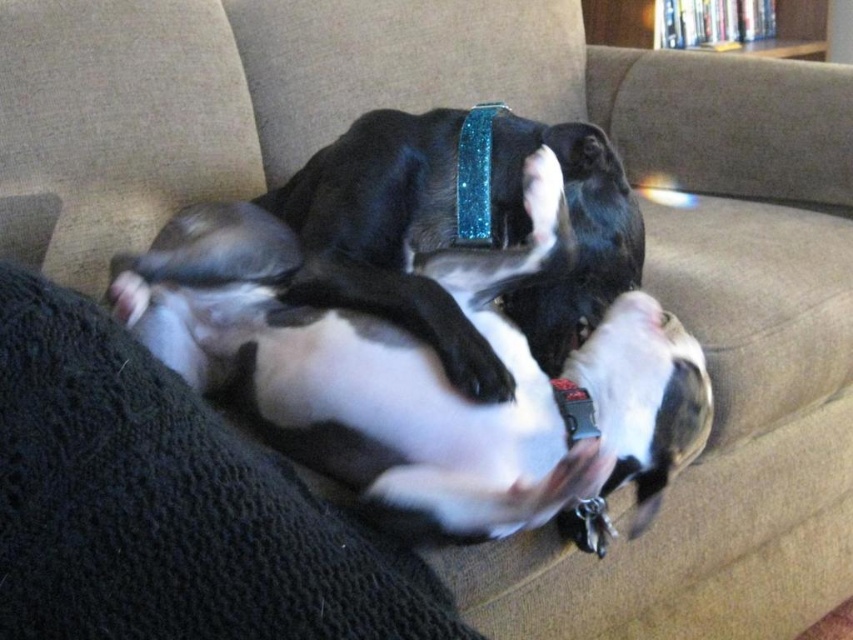
You are a dog owner who wants to place a new toy between the black shiny dog at center and the glittery blue neckband at center. Based on their positions, which object should be closer to the front of the couch?

The black shiny dog at center is taller than the glittery blue neckband at center, so the black shiny dog at center is closer to the front of the couch.

You are a dog owner trying to find the glittery blue neckband at center for your dog. You see the black knitted blanket at lower left. Which direction should you look relative to the blanket to find the neckband?

The glittery blue neckband at center is to the right of the black knitted blanket at lower left, so you should look to the right of the blanket to find the neckband.